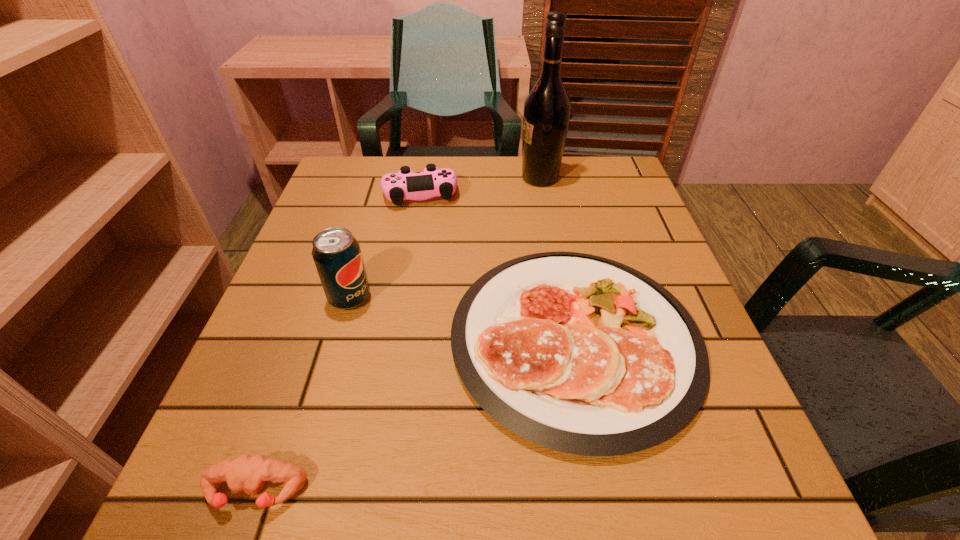
Identify the location of free space that is in between the wine bottle and the third shortest object. This screenshot has width=960, height=540. (480, 186).

At what (x,y) coordinates should I click in order to perform the action: click on empty space between the control and the soda can. Please return your answer as a coordinate pair (x, y). The width and height of the screenshot is (960, 540). Looking at the image, I should click on (385, 246).

Locate an element on the screen. object that is the second closest to the control is located at coordinates (578, 353).

Choose which object is the nearest neighbor to the wine bottle. Please provide its 2D coordinates. Your answer should be formatted as a tuple, i.e. [(x, y)], where the tuple contains the x and y coordinates of a point satisfying the conditions above.

[(405, 185)]

This screenshot has width=960, height=540. What are the coordinates of `vacant space that satisfies the following two spatial constraints: 1. on the label of the dish; 2. on the right side of the wine bottle` in the screenshot? It's located at (569, 340).

The image size is (960, 540). Identify the location of vacant region that satisfies the following two spatial constraints: 1. on the back side of the third tallest object; 2. on the left side of the fourth shortest object. (380, 194).

You are a GUI agent. You are given a task and a screenshot of the screen. Output one action in this format:
    pyautogui.click(x=<x>, y=<y>)
    Task: Click on the free spot that satisfies the following two spatial constraints: 1. on the back side of the dish; 2. on the label of the wine bottle
    
    Given the screenshot: What is the action you would take?
    pyautogui.click(x=543, y=178)

Locate an element on the screen. The image size is (960, 540). vacant space that satisfies the following two spatial constraints: 1. on the label of the dish; 2. on the right side of the wine bottle is located at coordinates (569, 340).

Find the location of a particular element. free space that satisfies the following two spatial constraints: 1. on the label of the tallest object; 2. on the front side of the third tallest object is located at coordinates (543, 194).